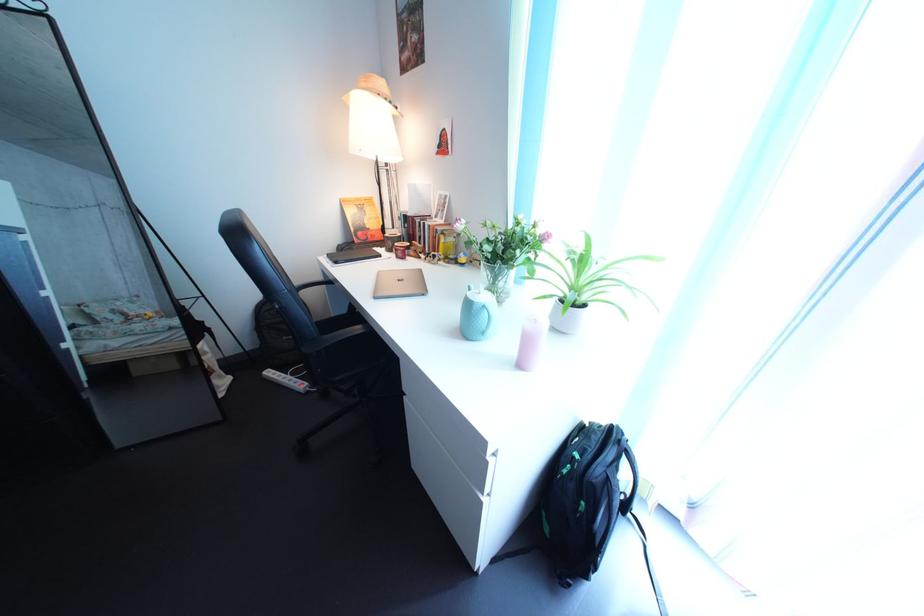
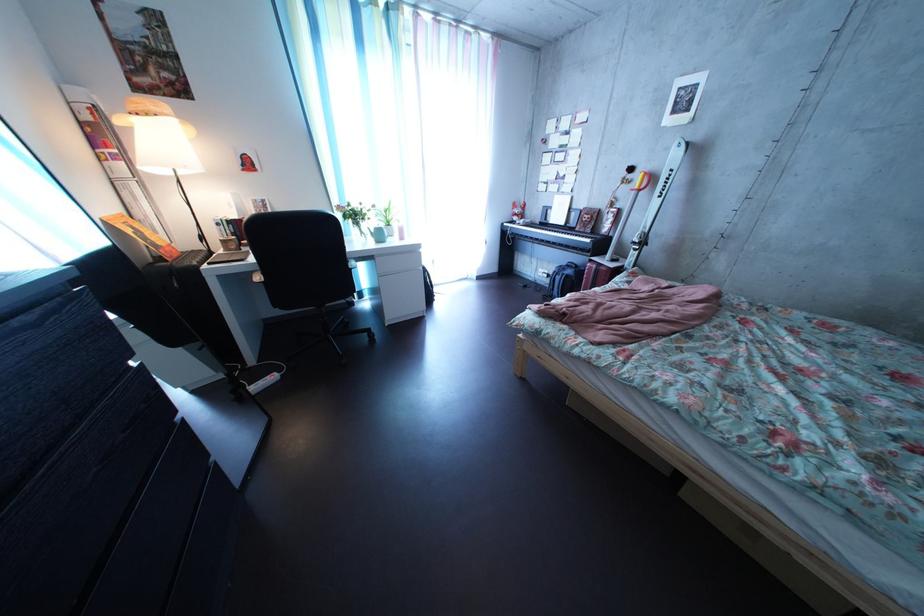
Question: I am providing you with two images of the same scene from different viewpoints. Which of the following objects are not visible in image2?

Choices:
 (A) ski pole handle
 (B) closed silver laptop
 (C) scalloped table lamp
 (D) laptop computer

Answer: (B)